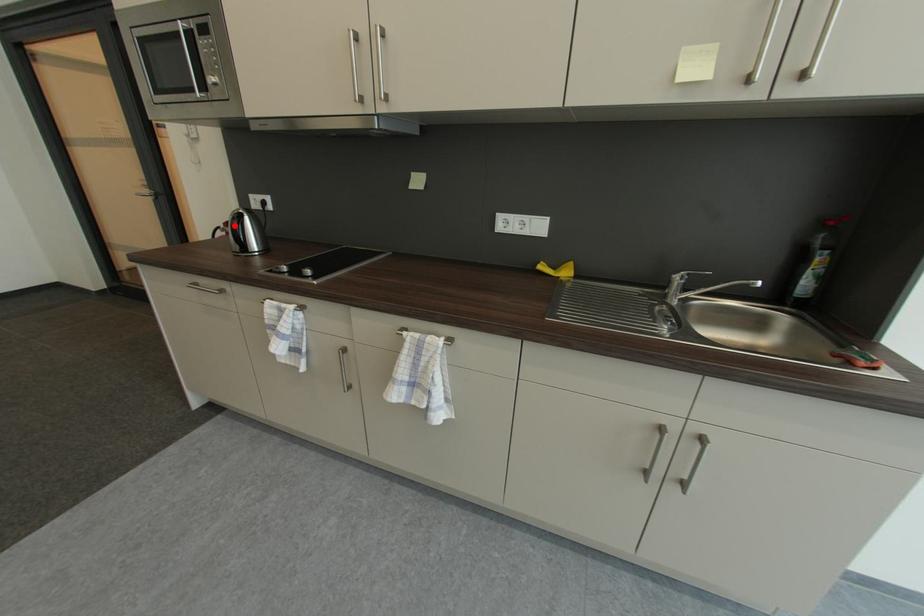
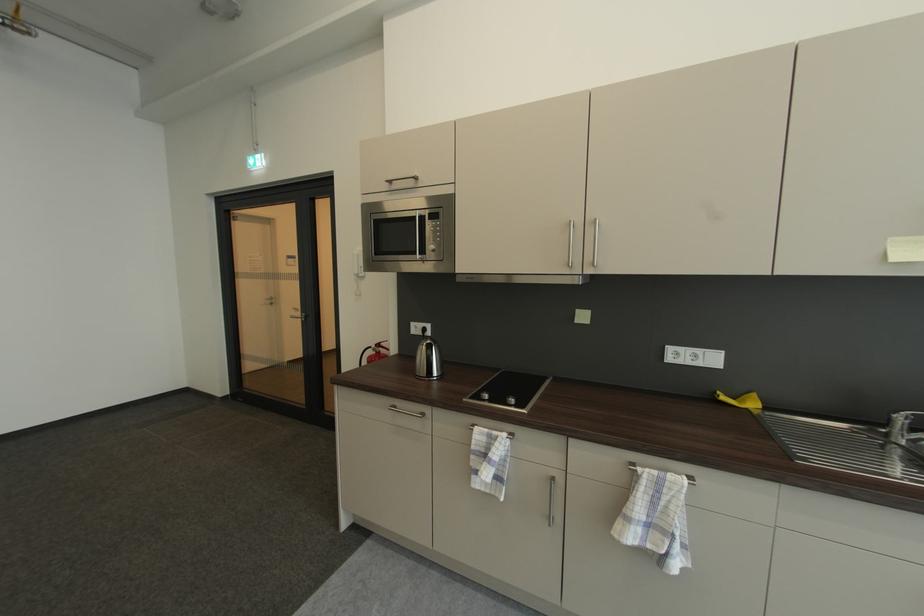
The point at the highlighted location is marked in the first image. Where is the corresponding point in the second image?

(384, 347)